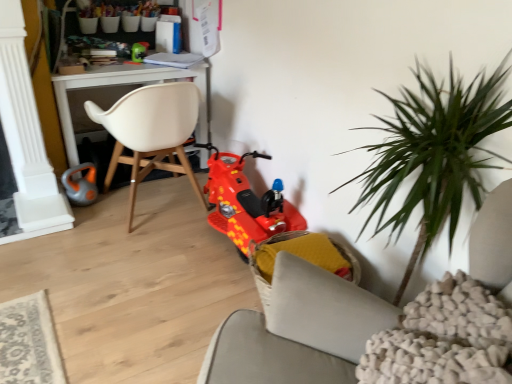
At what (x,y) coordinates should I click in order to perform the action: click on vacant space that's between orange rubber toy at lower left, arranged as the first toy when viewed from the left, and white matte chair at center, which is the 2th chair from right to left. Please return your answer as a coordinate pair (x, y). Looking at the image, I should click on (105, 217).